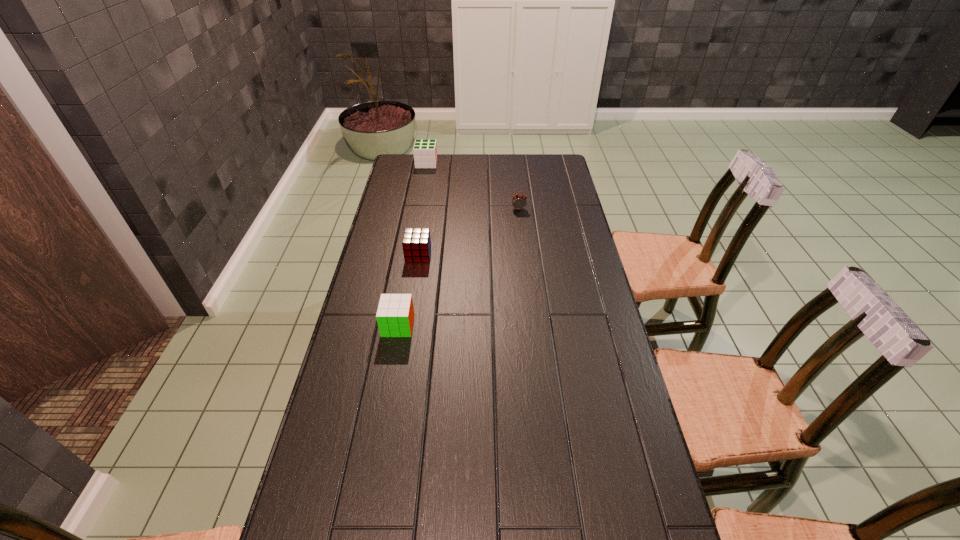
Find the location of `object present at the far left corner`. object present at the far left corner is located at coordinates (425, 151).

Image resolution: width=960 pixels, height=540 pixels. What are the coordinates of `vacant area at the far edge` in the screenshot? It's located at (436, 180).

The width and height of the screenshot is (960, 540). In the image, there is a desktop. In order to click on vacant area at the left edge in this screenshot , I will do `click(325, 492)`.

Where is `vacant space at the right edge of the desktop`? Image resolution: width=960 pixels, height=540 pixels. vacant space at the right edge of the desktop is located at coordinates (581, 360).

The height and width of the screenshot is (540, 960). Identify the location of blank region between the farthest object and the second farthest object. (472, 186).

At what (x,y) coordinates should I click in order to perform the action: click on free spot between the farthest cube and the second farthest object. Please return your answer as a coordinate pair (x, y). Looking at the image, I should click on (472, 186).

Locate an element on the screen. empty location between the second nearest object and the nearest cube is located at coordinates click(x=408, y=290).

At what (x,y) coordinates should I click in order to perform the action: click on free space between the nearest cube and the second nearest cube. Please return your answer as a coordinate pair (x, y). The height and width of the screenshot is (540, 960). Looking at the image, I should click on (408, 290).

I want to click on free area in between the second nearest cube and the nearest cube, so pyautogui.click(x=408, y=290).

Identify the location of empty space between the alarm clock and the nearest cube. (459, 267).